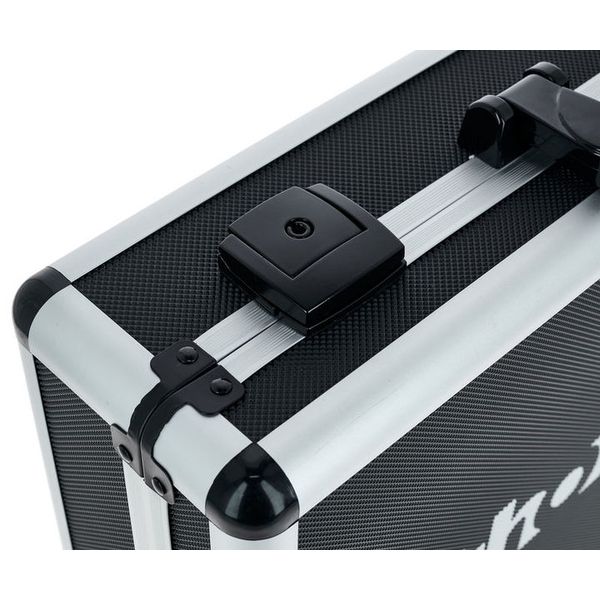
You are a GUI agent. You are given a task and a screenshot of the screen. Output one action in this format:
    pyautogui.click(x=<x>, y=<y>)
    Task: Click on the handle
    
    Given the screenshot: What is the action you would take?
    pyautogui.click(x=576, y=124)